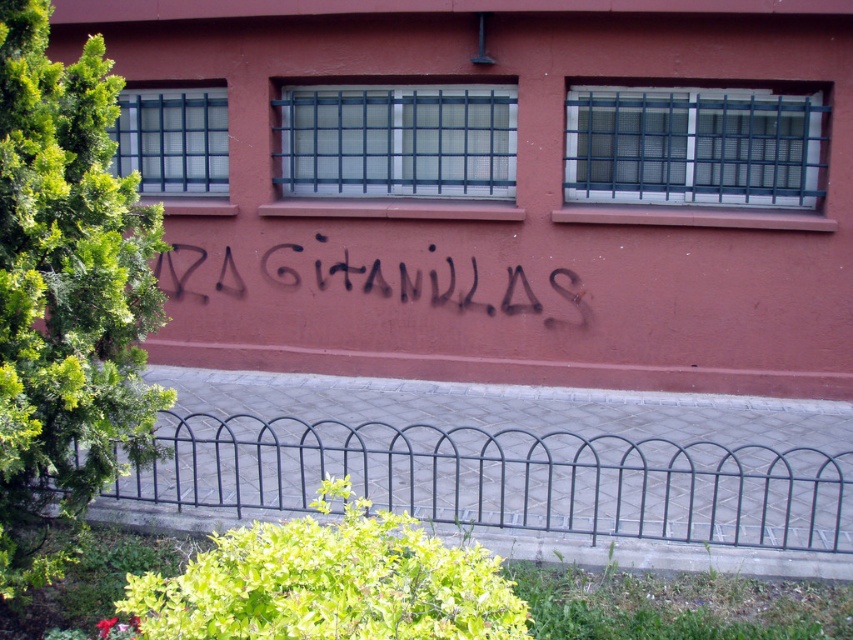
Does point (532, 518) come farther from viewer compared to point (276, 243)?

No, (532, 518) is closer to viewer.

Between black metal fence at lower center and black spray paint graffiti at center, which one is positioned higher?

black spray paint graffiti at center is above.

The height and width of the screenshot is (640, 853). What do you see at coordinates (508, 477) in the screenshot? I see `black metal fence at lower center` at bounding box center [508, 477].

The height and width of the screenshot is (640, 853). In order to click on black metal fence at lower center in this screenshot , I will do `click(508, 477)`.